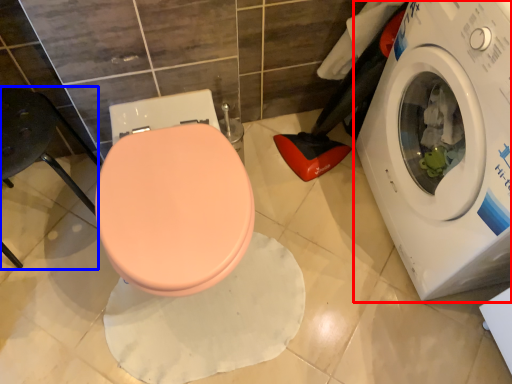
Question: Among these objects, which one is farthest to the camera, washing machine (highlighted by a red box) or chair (highlighted by a blue box)?

Choices:
 (A) washing machine
 (B) chair

Answer: (B)